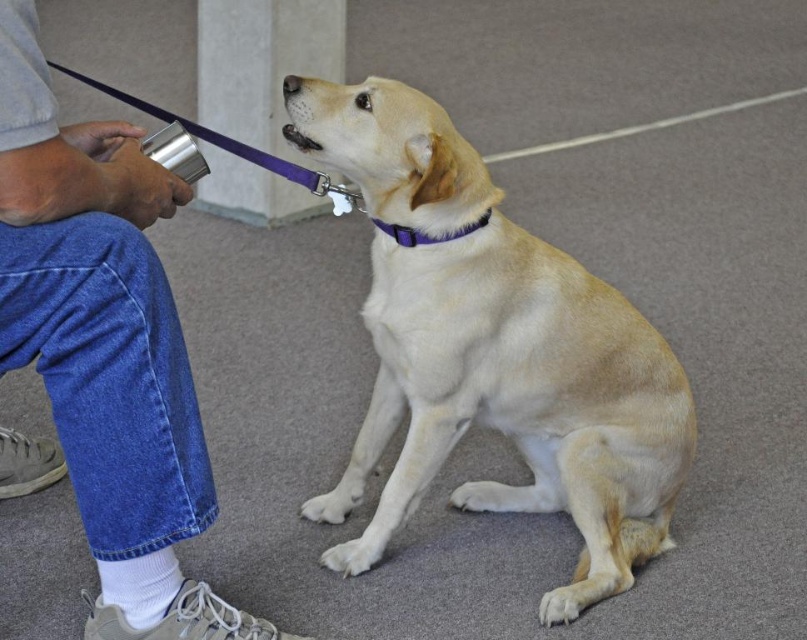
You are a dog trainer assessing the setup for a training exercise. You notice the brushed metal cup at left and the purple fabric collar at upper center. Which object is taller in the scene?

The brushed metal cup at left is taller than the purple fabric collar at upper center.

You are standing at the position of the camera and want to throw a ball to the point marked as point (203, 452). If the ball travels in a straight line, how far will it travel before reaching the point?

The point (203, 452) is 5.10 feet away from the camera, so the ball will travel 5.10 feet to reach it.

You are a dog trainer assessing the setup for a training exercise. The dog has a light brown fur at center and a brushed metal cup at left. Which object takes up more space in the image?

The light brown fur at center is larger in size than the brushed metal cup at left, so it takes up more space in the image.